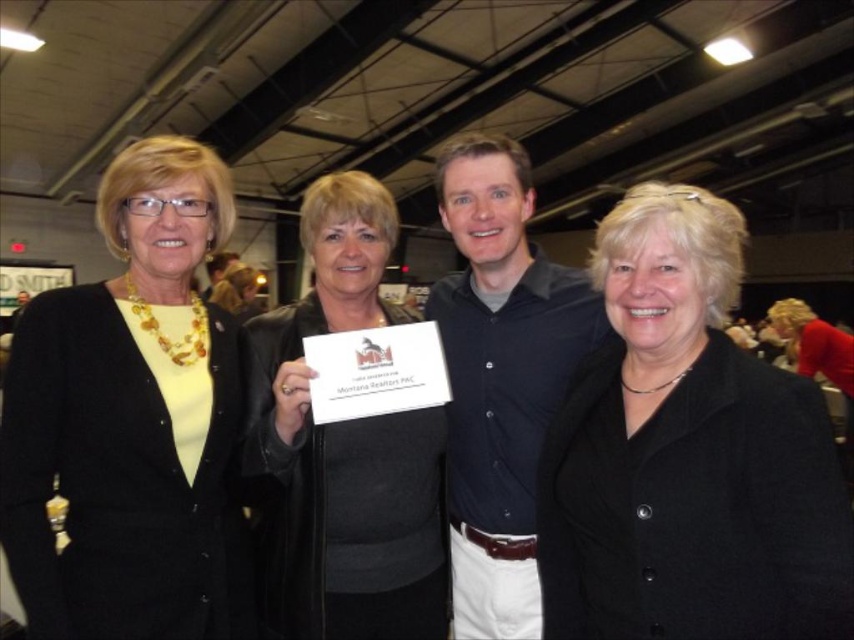
You are a photographer at the event and need to capture a photo of the group without any overlapping figures. Since the black matte jacket at center is in front of the yellow matte cardigan at left, where should you position the camera to ensure both are visible without obstruction?

To ensure both the black matte jacket at center and the yellow matte cardigan at left are visible without obstruction, position the camera so that the black matte jacket at center is moved slightly to the side or the yellow matte cardigan at left is shifted backward, as the current arrangement has the black matte jacket at center blocking part of the yellow matte cardigan at left.